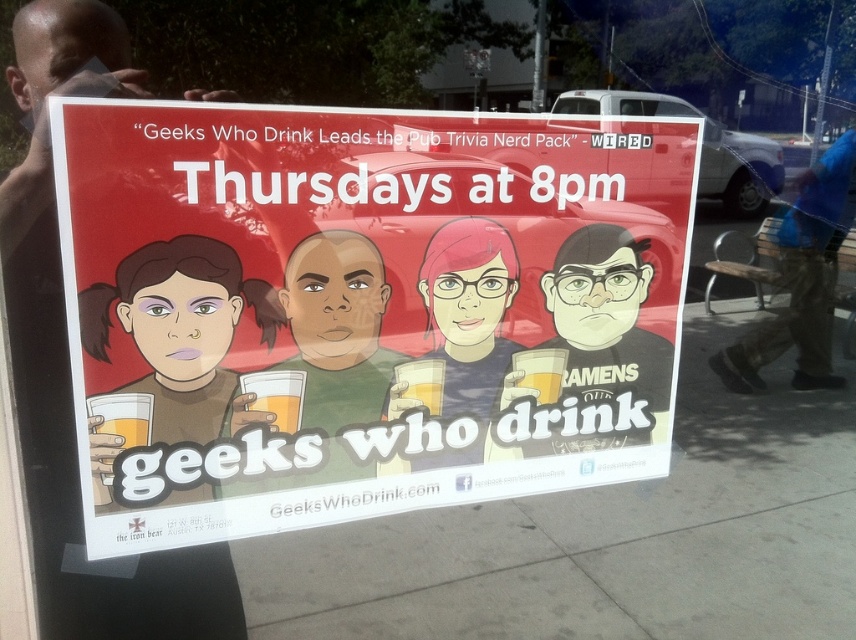
You are standing in front of the promotional poster and notice the matte black shirt at center. Can you determine its exact position on the poster using the coordinate system provided?

The matte black shirt at center is located at point (x=468, y=323) according to the coordinate system provided.